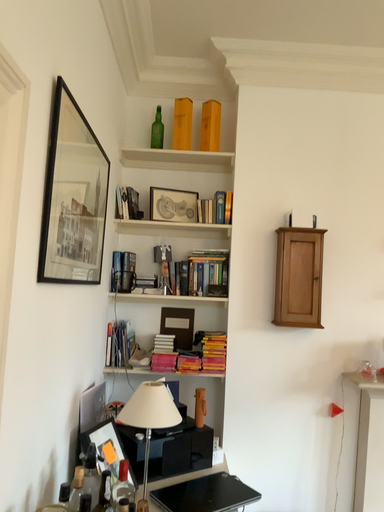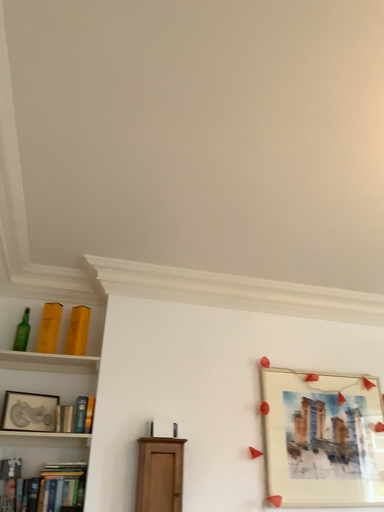
Question: How did the camera likely rotate when shooting the video?

Choices:
 (A) rotated left
 (B) rotated right

Answer: (B)